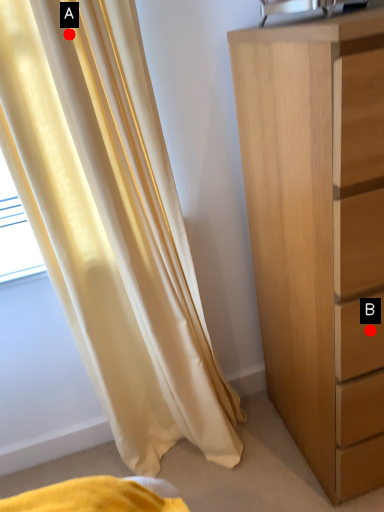
Question: Two points are circled on the image, labeled by A and B beside each circle. Which point appears farthest from the camera in this image?

Choices:
 (A) A is further
 (B) B is further

Answer: (B)